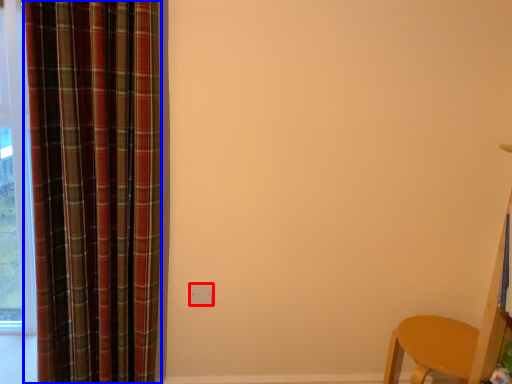
Question: Which point is closer to the camera, electric outlet (highlighted by a red box) or curtain (highlighted by a blue box)?

Choices:
 (A) electric outlet
 (B) curtain

Answer: (B)